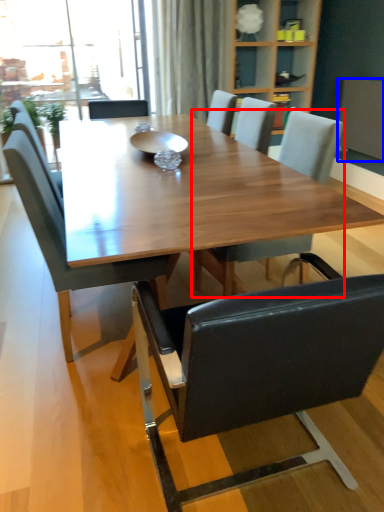
Question: Which of the following is the closest to the observer, chair (highlighted by a red box) or radiator (highlighted by a blue box)?

Choices:
 (A) chair
 (B) radiator

Answer: (A)